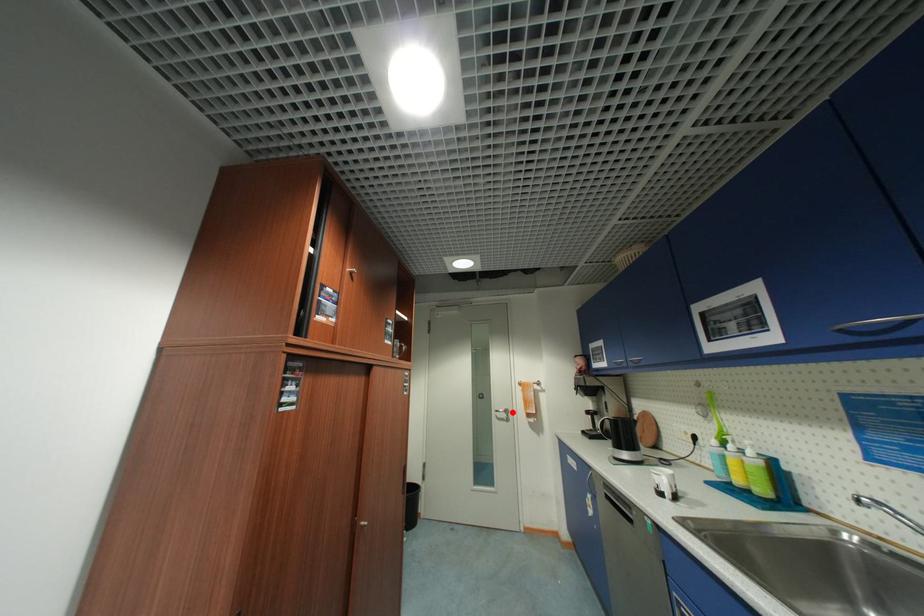
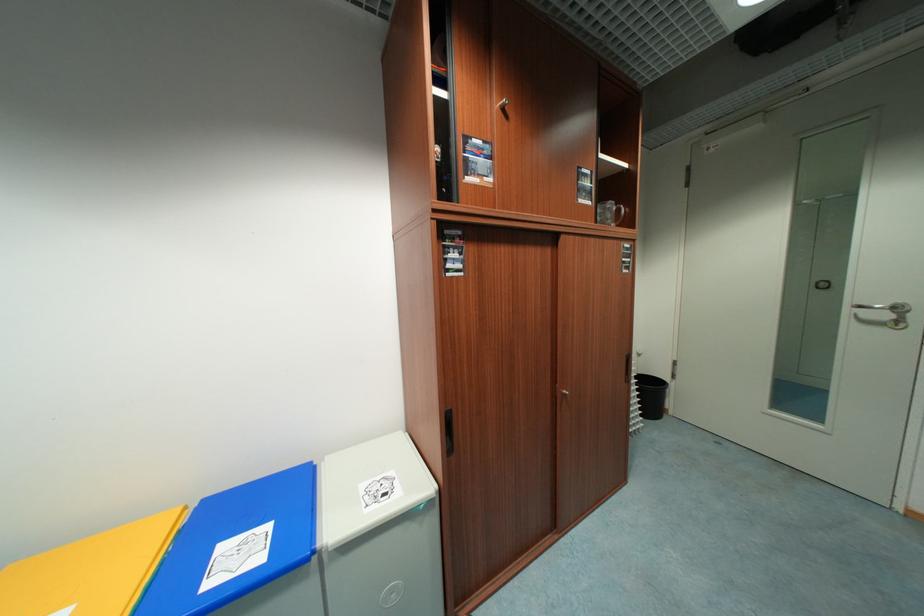
Locate, in the second image, the point that corresponds to the highlighted location in the first image.

(904, 310)